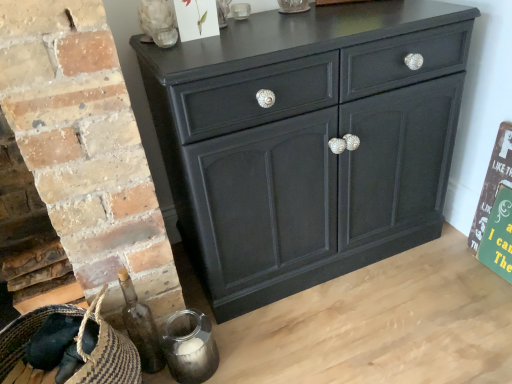
Question: Is matte black cabinet at center behind braided straw basket at lower left?

Choices:
 (A) no
 (B) yes

Answer: (B)

Question: Is matte black cabinet at center positioned with its back to braided straw basket at lower left?

Choices:
 (A) yes
 (B) no

Answer: (B)

Question: Can you confirm if matte black cabinet at center is shorter than braided straw basket at lower left?

Choices:
 (A) no
 (B) yes

Answer: (A)

Question: Is matte black cabinet at center outside braided straw basket at lower left?

Choices:
 (A) yes
 (B) no

Answer: (A)

Question: Does matte black cabinet at center appear on the right side of braided straw basket at lower left?

Choices:
 (A) yes
 (B) no

Answer: (A)

Question: From their relative heights in the image, would you say braided straw basket at lower left is taller or shorter than transparent glass skull at upper left?

Choices:
 (A) short
 (B) tall

Answer: (B)

Question: Is braided straw basket at lower left wider or thinner than transparent glass skull at upper left?

Choices:
 (A) thin
 (B) wide

Answer: (B)

Question: From a real-world perspective, is braided straw basket at lower left positioned above or below transparent glass skull at upper left?

Choices:
 (A) above
 (B) below

Answer: (B)

Question: Considering the relative positions of braided straw basket at lower left and transparent glass skull at upper left in the image provided, is braided straw basket at lower left to the left or to the right of transparent glass skull at upper left?

Choices:
 (A) left
 (B) right

Answer: (A)

Question: Considering the positions of point (421, 206) and point (159, 4), is point (421, 206) closer or farther from the camera than point (159, 4)?

Choices:
 (A) closer
 (B) farther

Answer: (B)

Question: Is matte black cabinet at center situated inside transparent glass skull at upper left or outside?

Choices:
 (A) inside
 (B) outside

Answer: (B)

Question: Is matte black cabinet at center bigger or smaller than transparent glass skull at upper left?

Choices:
 (A) small
 (B) big

Answer: (B)

Question: Is matte black cabinet at center to the left or to the right of transparent glass skull at upper left in the image?

Choices:
 (A) right
 (B) left

Answer: (A)

Question: Is matte black cabinet at center in front of or behind braided straw basket at lower left in the image?

Choices:
 (A) front
 (B) behind

Answer: (B)

Question: From the image's perspective, is matte black cabinet at center above or below braided straw basket at lower left?

Choices:
 (A) below
 (B) above

Answer: (B)